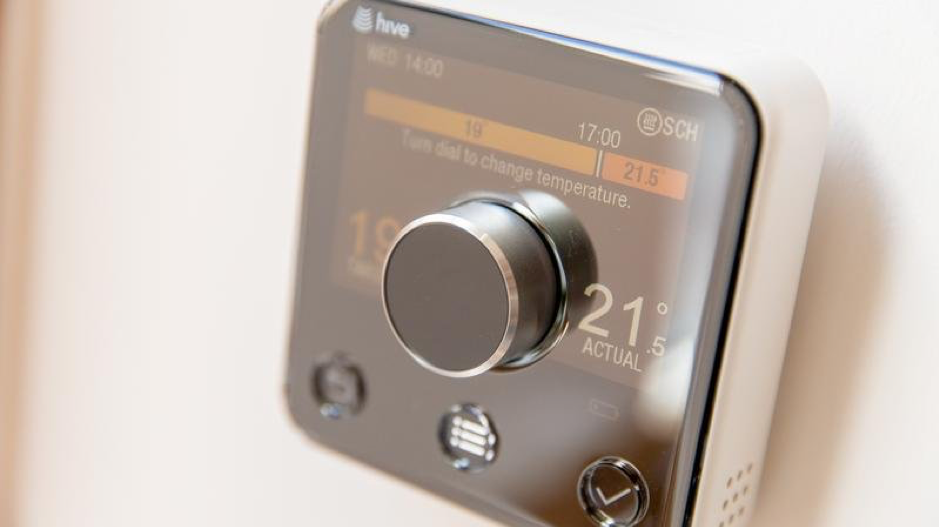
Identify the location of thermostat. (750, 208).